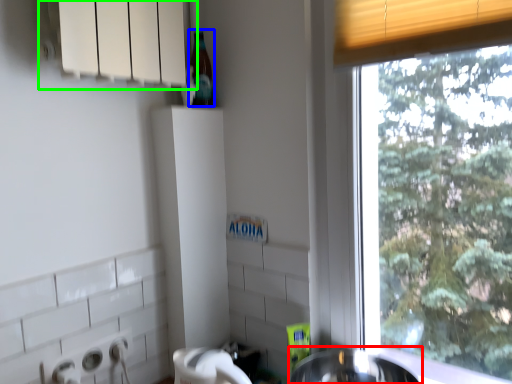
Question: Based on their relative distances, which object is nearer to sink (highlighted by a red box)? Choose from bottle (highlighted by a blue box) and window sill (highlighted by a green box).

Choices:
 (A) bottle
 (B) window sill

Answer: (A)